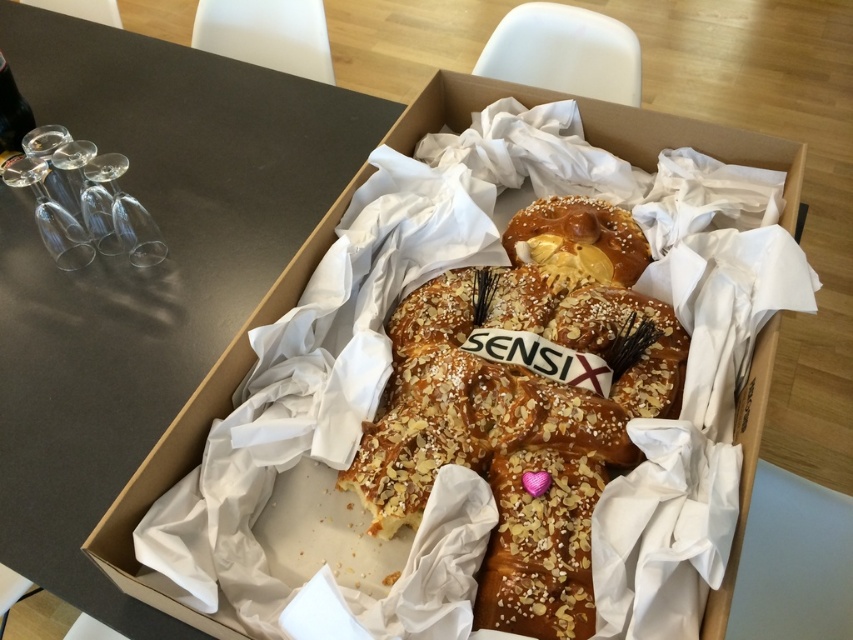
Is golden glazed pastry at center to the right of clear glass wine glass at left from the viewer's perspective?

Yes, golden glazed pastry at center is to the right of clear glass wine glass at left.

Between golden glazed pastry at center and clear glass wine glass at left, which one has more height?

Standing taller between the two is clear glass wine glass at left.

Who is more forward, (608, 248) or (33, 172)?

Positioned in front is point (33, 172).

At what (x,y) coordinates should I click in order to perform the action: click on golden glazed pastry at center. Please return your answer as a coordinate pair (x, y). Image resolution: width=853 pixels, height=640 pixels. Looking at the image, I should click on (577, 243).

Is smooth gray table at center positioned at the back of clear glass wine glass at left?

No.

Can you confirm if smooth gray table at center is shorter than clear glass wine glass at left?

No.

Image resolution: width=853 pixels, height=640 pixels. Describe the element at coordinates (144, 269) in the screenshot. I see `smooth gray table at center` at that location.

Locate an element on the screen. The height and width of the screenshot is (640, 853). smooth gray table at center is located at coordinates (144, 269).

Consider the image. Is golden glazed pastry at center below transparent glass wine glass at left?

Yes.

Between golden glazed pastry at center and transparent glass wine glass at left, which one is positioned lower?

golden glazed pastry at center is below.

Locate an element on the screen. golden glazed pastry at center is located at coordinates (577, 243).